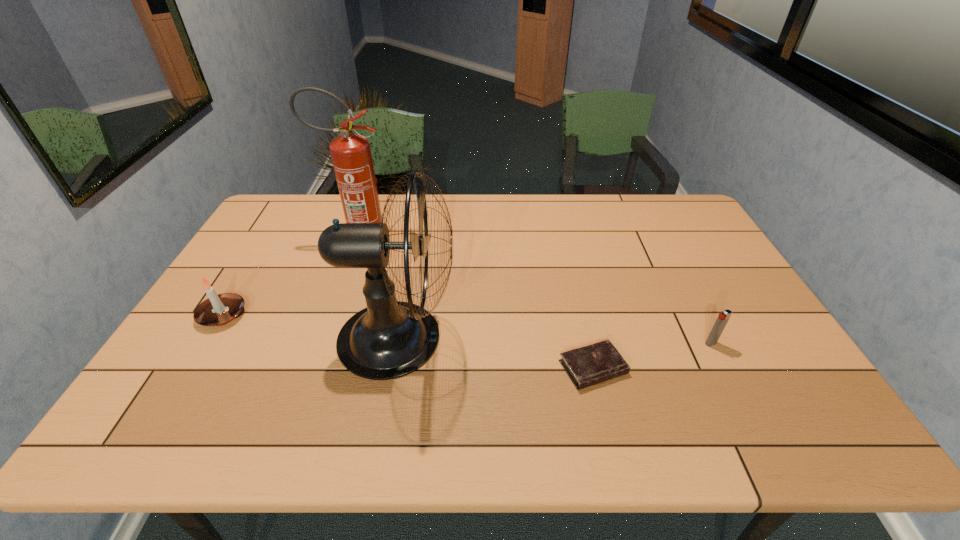
The width and height of the screenshot is (960, 540). I want to click on the farthest object, so click(x=351, y=156).

At what (x,y) coordinates should I click in order to perform the action: click on fan. Please return your answer as a coordinate pair (x, y). Looking at the image, I should click on (389, 339).

At what (x,y) coordinates should I click in order to perform the action: click on the leftmost object. Please return your answer as a coordinate pair (x, y). Image resolution: width=960 pixels, height=540 pixels. Looking at the image, I should click on (x=217, y=310).

Identify the location of the third tallest object. (217, 310).

You are a GUI agent. You are given a task and a screenshot of the screen. Output one action in this format:
    pyautogui.click(x=<x>, y=<y>)
    Task: Click on the igniter
    
    Given the screenshot: What is the action you would take?
    pyautogui.click(x=723, y=317)

Where is `the rightmost object`? This screenshot has width=960, height=540. the rightmost object is located at coordinates (723, 317).

Identify the location of the fourth object from left to right. (599, 362).

Where is `the shortest object`? This screenshot has height=540, width=960. the shortest object is located at coordinates coord(599,362).

Locate an element on the screen. free space located 0.160m from the nozzle of the farthest object is located at coordinates (440, 239).

Where is `vacant space located 0.280m on the front-facing side of the fan`? vacant space located 0.280m on the front-facing side of the fan is located at coordinates (564, 339).